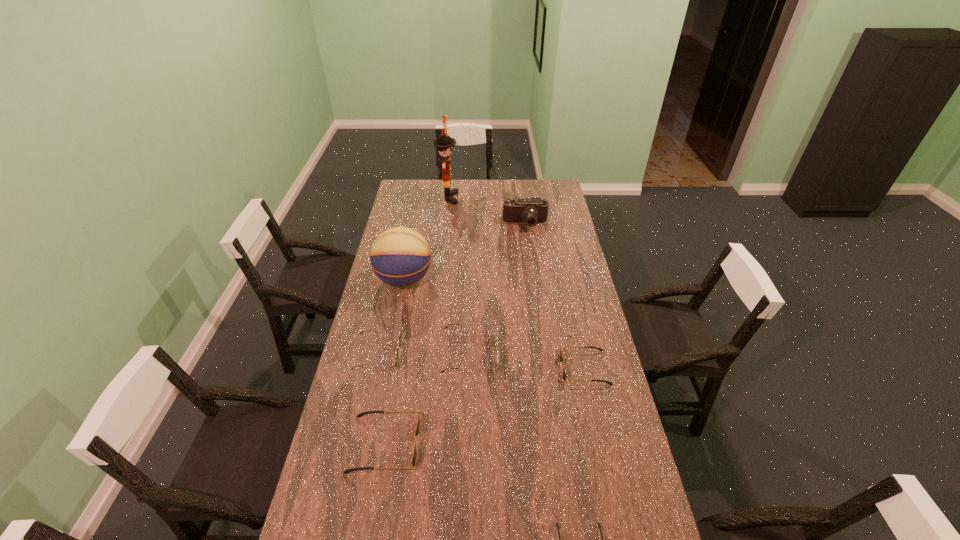
This screenshot has width=960, height=540. Find the location of `nutcracker`. nutcracker is located at coordinates (445, 144).

Find the location of a particular element. The image size is (960, 540). the tallest object is located at coordinates (445, 144).

The width and height of the screenshot is (960, 540). In order to click on blue basketball in this screenshot , I will do `click(400, 256)`.

Locate an element on the screen. The width and height of the screenshot is (960, 540). the second tallest object is located at coordinates (400, 256).

Identify the location of the seventh shortest object. Image resolution: width=960 pixels, height=540 pixels. (533, 210).

Identify the location of the eighth nearest object. The image size is (960, 540). (533, 210).

You are a GUI agent. You are given a task and a screenshot of the screen. Output one action in this format:
    pyautogui.click(x=<x>, y=<y>)
    Task: Click on the biggest green sunglasses
    This screenshot has height=540, width=960.
    Given the screenshot: What is the action you would take?
    pyautogui.click(x=496, y=323)

This screenshot has width=960, height=540. In order to click on the seventh farthest object in this screenshot , I will do `click(417, 430)`.

At what (x,y) coordinates should I click in order to perform the action: click on the third nearest sunglasses. Please return your answer as a coordinate pair (x, y). The image size is (960, 540). Looking at the image, I should click on (417, 430).

In order to click on the leftmost green sunglasses in this screenshot , I will do `click(400, 334)`.